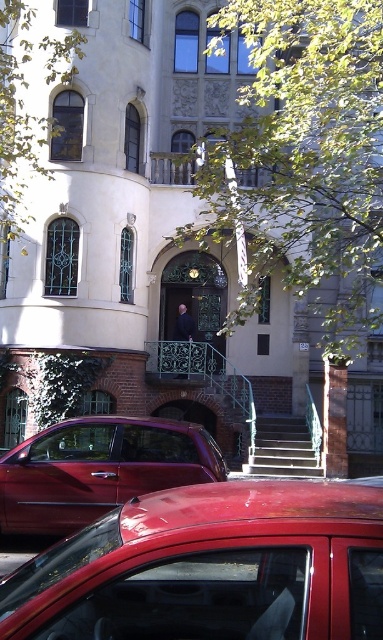
Question: Is shiny red car at lower center below smooth black suit at center?

Choices:
 (A) yes
 (B) no

Answer: (A)

Question: Estimate the real-world distances between objects in this image. Which object is closer to the metallic gray stairs at center?

Choices:
 (A) smooth black suit at center
 (B) shiny metallic car at lower left
 (C) shiny red car at lower center

Answer: (A)

Question: Which point appears farthest from the camera in this image?

Choices:
 (A) (278, 467)
 (B) (129, 451)

Answer: (A)

Question: Is metallic gray stairs at center smaller than smooth black suit at center?

Choices:
 (A) yes
 (B) no

Answer: (B)

Question: Does shiny red car at lower center appear on the left side of smooth black suit at center?

Choices:
 (A) yes
 (B) no

Answer: (B)

Question: Which point appears farthest from the camera in this image?

Choices:
 (A) (78, 497)
 (B) (183, 326)
 (C) (253, 465)

Answer: (B)